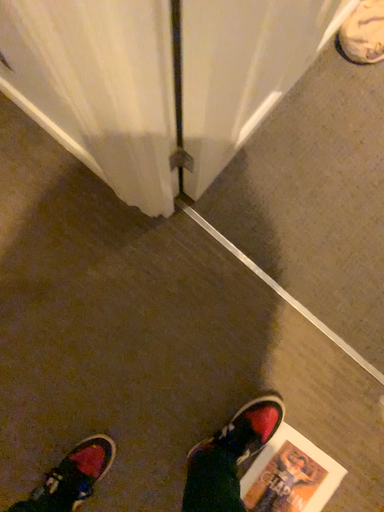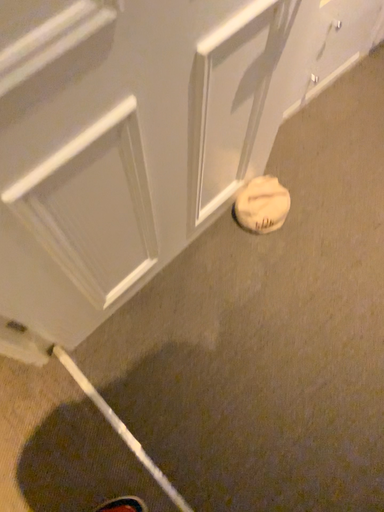
Question: Which way did the camera rotate in the video?

Choices:
 (A) rotated downward
 (B) rotated upward

Answer: (B)